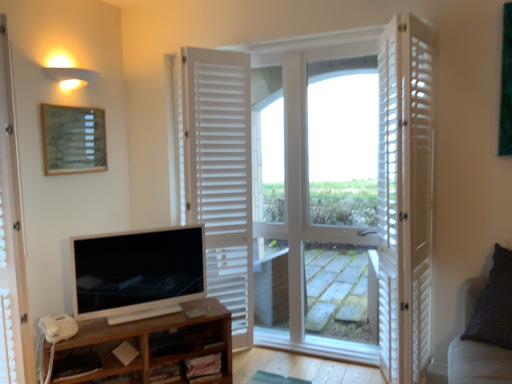
Question: Is point (332, 248) closer or farther from the camera than point (227, 372)?

Choices:
 (A) closer
 (B) farther

Answer: (B)

Question: From a real-world perspective, is white wooden door at center, arranged as the second door when viewed from the left, positioned above or below brown wood shelf at lower left?

Choices:
 (A) above
 (B) below

Answer: (A)

Question: Estimate the real-world distances between objects in this image. Which object is closer to the white glossy television at lower left?

Choices:
 (A) white plastic phone at lower left
 (B) white wooden door at center, placed as the 3th door when sorted from right to left
 (C) white wooden door at center, arranged as the second door when viewed from the left
 (D) matte white sconce at upper left
 (E) brown wood shelf at lower left

Answer: (E)

Question: Which object is the farthest from the white glossy television at lower left?

Choices:
 (A) white wooden door at center, placed as the 3th door when sorted from right to left
 (B) brown wood shelf at lower left
 (C) white wooden door at right, which is the first door in right-to-left order
 (D) matte wooden picture frame at upper left
 (E) dark gray fabric couch at right

Answer: (E)